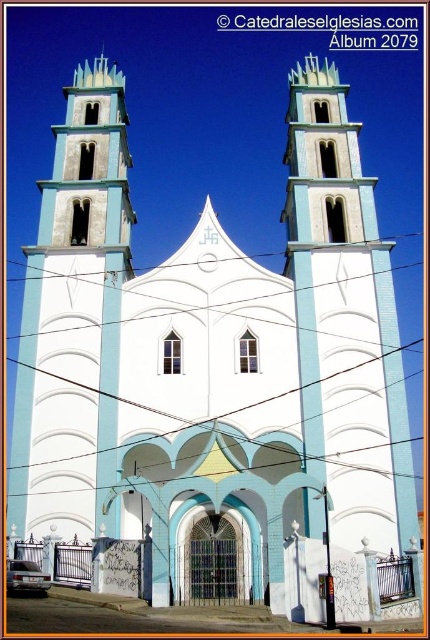
Who is more distant from viewer, [313,65] or [57,173]?

The point [313,65] is more distant.

Which is below, light blue stone tower at center or white smooth tower at center?

white smooth tower at center is lower down.

Is point (374, 512) in front of point (85, 90)?

That is True.

Where is `light blue stone tower at center`? The width and height of the screenshot is (430, 640). light blue stone tower at center is located at coordinates (344, 321).